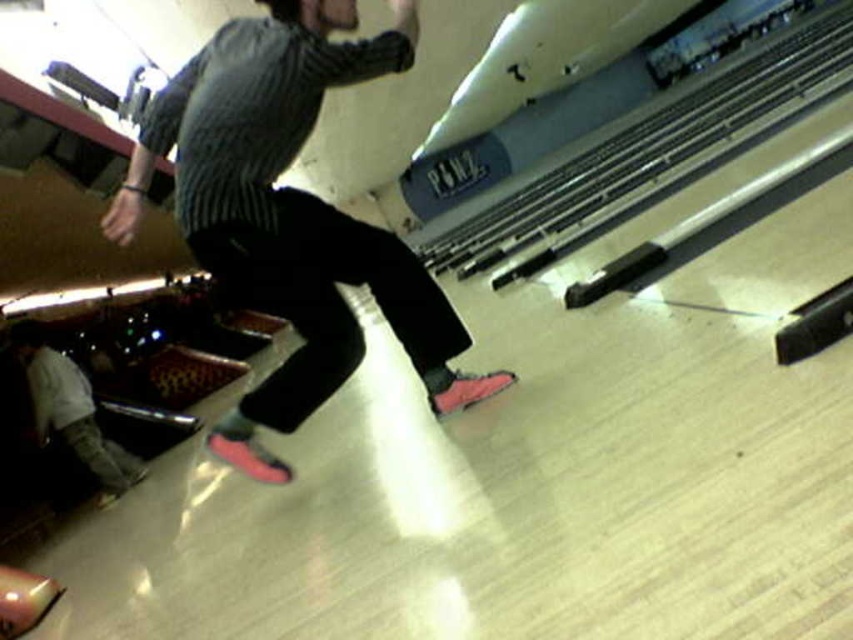
You are designing a layout for a new bowling alley and need to place a bench between the pink suede sneakers at center and the camouflage pants at lower left. Which object should the bench be closer to to ensure it doesn

The bench should be placed closer to the pink suede sneakers at center because it occupies less space than the camouflage pants at lower left.

You are standing at the point marked by the coordinates (289,212) in the bowling alley scene. What object are you standing on?

The point marked by the coordinates (289,212) is on the pink suede sneakers at center.